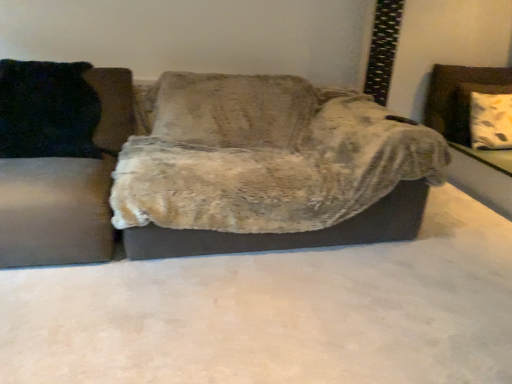
Question: Is black fuzzy pillow at left located within fuzzy fabric couch at center, the 2th studio couch from the left?

Choices:
 (A) no
 (B) yes

Answer: (A)

Question: Does fuzzy fabric couch at center, the 1th studio couch in the right-to-left sequence, have a lesser height compared to black fuzzy pillow at left?

Choices:
 (A) yes
 (B) no

Answer: (B)

Question: From a real-world perspective, is fuzzy fabric couch at center, the 2th studio couch from the left, on black fuzzy pillow at left?

Choices:
 (A) no
 (B) yes

Answer: (A)

Question: Does fuzzy fabric couch at center, the 2th studio couch from the left, lie behind black fuzzy pillow at left?

Choices:
 (A) yes
 (B) no

Answer: (B)

Question: Is fuzzy fabric couch at center, the 1th studio couch in the right-to-left sequence, facing away from black fuzzy pillow at left?

Choices:
 (A) yes
 (B) no

Answer: (B)

Question: Does black fuzzy pillow at left appear on the left side of white textured cushion at right?

Choices:
 (A) yes
 (B) no

Answer: (A)

Question: Is the surface of black fuzzy pillow at left in direct contact with white textured cushion at right?

Choices:
 (A) yes
 (B) no

Answer: (B)

Question: Is black fuzzy pillow at left oriented away from white textured cushion at right?

Choices:
 (A) no
 (B) yes

Answer: (A)

Question: Is black fuzzy pillow at left not within white textured cushion at right?

Choices:
 (A) yes
 (B) no

Answer: (A)

Question: From a real-world perspective, is black fuzzy pillow at left on top of white textured cushion at right?

Choices:
 (A) yes
 (B) no

Answer: (A)

Question: Does black fuzzy pillow at left have a larger size compared to white textured cushion at right?

Choices:
 (A) no
 (B) yes

Answer: (B)

Question: Is velvet black pillow at left, which is the first studio couch from left to right, to the left of white textured cushion at right from the viewer's perspective?

Choices:
 (A) no
 (B) yes

Answer: (B)